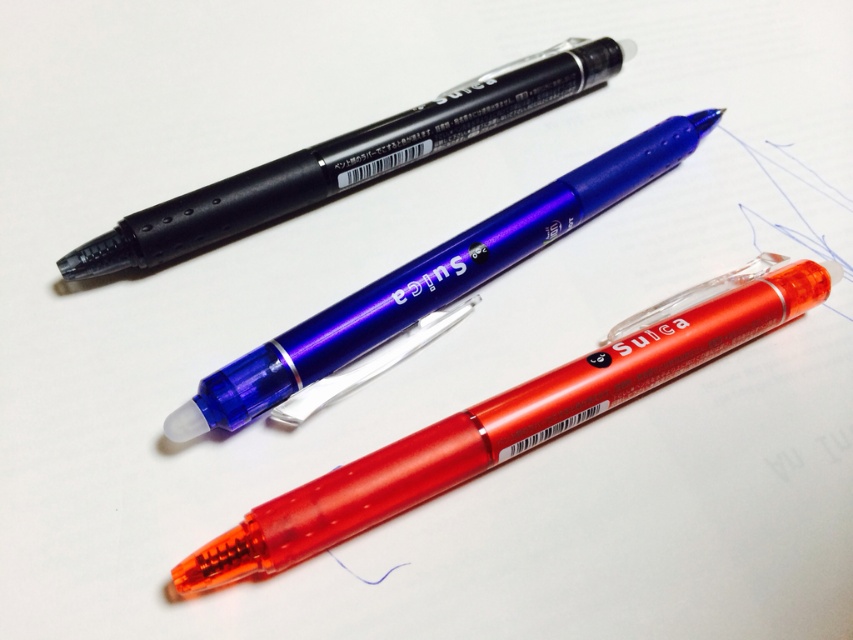
Can you confirm if transparent orange pen at center is wider than translucent blue pen at center?

Yes.

Measure the distance between transparent orange pen at center and translucent blue pen at center.

transparent orange pen at center is 8.07 inches from translucent blue pen at center.

Who is more distant from viewer, (x=682, y=364) or (x=561, y=193)?

Point (x=561, y=193)

Where is `transparent orange pen at center`? Image resolution: width=853 pixels, height=640 pixels. transparent orange pen at center is located at coordinates (494, 432).

Is transparent orange pen at center bigger than matte black pen at upper center?

Correct, transparent orange pen at center is larger in size than matte black pen at upper center.

From the picture: Does transparent orange pen at center appear over matte black pen at upper center?

No, transparent orange pen at center is not above matte black pen at upper center.

The width and height of the screenshot is (853, 640). What do you see at coordinates (494, 432) in the screenshot?
I see `transparent orange pen at center` at bounding box center [494, 432].

This screenshot has height=640, width=853. Identify the location of transparent orange pen at center. (494, 432).

Between translucent blue pen at center and matte black pen at upper center, which one has more height?

With more height is translucent blue pen at center.

Between point (392, 307) and point (463, 88), which one is positioned in front?

Point (392, 307) is more forward.

Between point (274, 337) and point (253, 195), which one is positioned behind?

The point (253, 195) is behind.

The image size is (853, 640). Find the location of `translucent blue pen at center`. translucent blue pen at center is located at coordinates (430, 280).